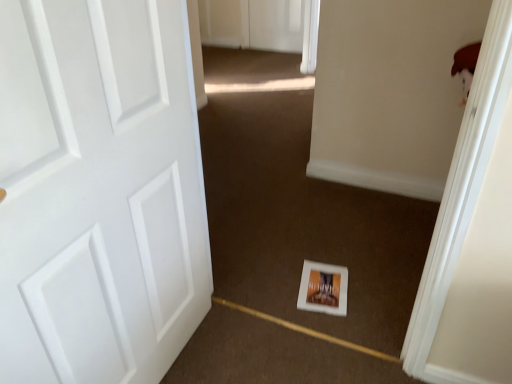
I want to click on vacant space situated above white matte postcard at center (from a real-world perspective), so click(326, 284).